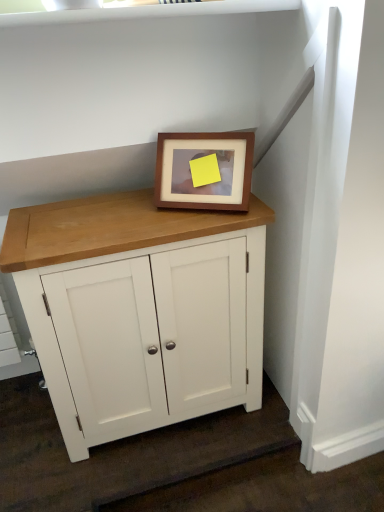
What do you see at coordinates (204, 170) in the screenshot? I see `wooden picture frame at center` at bounding box center [204, 170].

Locate an element on the screen. This screenshot has width=384, height=512. wooden picture frame at center is located at coordinates (204, 170).

The image size is (384, 512). In order to click on white painted wood cabinet at center in this screenshot , I will do `click(140, 310)`.

What do you see at coordinates (140, 310) in the screenshot? The height and width of the screenshot is (512, 384). I see `white painted wood cabinet at center` at bounding box center [140, 310].

This screenshot has height=512, width=384. I want to click on wooden picture frame at center, so click(204, 170).

Between white painted wood cabinet at center and wooden picture frame at center, which one appears on the right side from the viewer's perspective?

From the viewer's perspective, wooden picture frame at center appears more on the right side.

Relative to wooden picture frame at center, is white painted wood cabinet at center in front or behind?

Visually, white painted wood cabinet at center is located in front of wooden picture frame at center.

Does point (221, 261) come behind point (218, 194)?

Yes, point (221, 261) is farther from viewer.

From the image's perspective, is white painted wood cabinet at center over wooden picture frame at center?

No.

From a real-world perspective, is white painted wood cabinet at center over wooden picture frame at center?

Actually, white painted wood cabinet at center is physically below wooden picture frame at center in the real world.

Between white painted wood cabinet at center and wooden picture frame at center, which one has smaller width?

Thinner between the two is wooden picture frame at center.

Who is taller, white painted wood cabinet at center or wooden picture frame at center?

Standing taller between the two is white painted wood cabinet at center.

Looking at the image, does white painted wood cabinet at center seem bigger or smaller compared to wooden picture frame at center?

In the image, white painted wood cabinet at center appears to be larger than wooden picture frame at center.

Is white painted wood cabinet at center not inside wooden picture frame at center?

Yes, white painted wood cabinet at center is located beyond the bounds of wooden picture frame at center.

Is the surface of white painted wood cabinet at center in direct contact with wooden picture frame at center?

white painted wood cabinet at center is not next to wooden picture frame at center, and they're not touching.

Is white painted wood cabinet at center aimed at wooden picture frame at center?

No, white painted wood cabinet at center is not aimed at wooden picture frame at center.

I want to click on picture frame above the white painted wood cabinet at center (from the image's perspective), so click(x=204, y=170).

Between wooden picture frame at center and white painted wood cabinet at center, which one appears on the right side from the viewer's perspective?

wooden picture frame at center.

Is the depth of wooden picture frame at center greater than that of white painted wood cabinet at center?

Yes.

Is point (200, 192) positioned in front of point (123, 396)?

Yes, it is in front of point (123, 396).

From the image's perspective, is wooden picture frame at center beneath white painted wood cabinet at center?

No, from the image's perspective, wooden picture frame at center is not below white painted wood cabinet at center.

From a real-world perspective, which is physically below, wooden picture frame at center or white painted wood cabinet at center?

white painted wood cabinet at center, from a real-world perspective.

In terms of width, does wooden picture frame at center look wider or thinner when compared to white painted wood cabinet at center?

In the image, wooden picture frame at center appears to be more narrow than white painted wood cabinet at center.

Does wooden picture frame at center have a lesser height compared to white painted wood cabinet at center?

Yes, wooden picture frame at center is shorter than white painted wood cabinet at center.

Is wooden picture frame at center smaller than white painted wood cabinet at center?

Yes, wooden picture frame at center is smaller than white painted wood cabinet at center.

Which is correct: wooden picture frame at center is inside white painted wood cabinet at center, or outside of it?

wooden picture frame at center is outside white painted wood cabinet at center.

Is wooden picture frame at center not close to white painted wood cabinet at center?

No, wooden picture frame at center is not far away from white painted wood cabinet at center.

Is wooden picture frame at center looking in the opposite direction of white painted wood cabinet at center?

No, wooden picture frame at center is not facing the opposite direction of white painted wood cabinet at center.

What's the angular difference between wooden picture frame at center and white painted wood cabinet at center's facing directions?

wooden picture frame at center and white painted wood cabinet at center are facing 31.2 degrees away from each other.

What are the coordinates of `picture frame on the right of white painted wood cabinet at center` in the screenshot? It's located at (204, 170).

Image resolution: width=384 pixels, height=512 pixels. Find the location of `table that appears on the left of wooden picture frame at center`. table that appears on the left of wooden picture frame at center is located at coordinates 140,310.

Image resolution: width=384 pixels, height=512 pixels. What are the coordinates of `table in front of the wooden picture frame at center` in the screenshot? It's located at (140, 310).